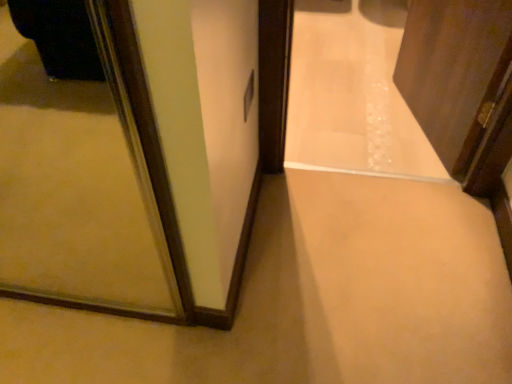
The image size is (512, 384). In order to click on wooden door at upper right in this screenshot , I will do `click(454, 71)`.

What is the approximate width of wooden door at upper right?

wooden door at upper right is 5.74 inches in width.

The height and width of the screenshot is (384, 512). What do you see at coordinates (454, 71) in the screenshot?
I see `wooden door at upper right` at bounding box center [454, 71].

In order to face wooden door at upper right, should I rotate leftwards or rightwards?

Turn right by 23.302 degrees to look at wooden door at upper right.

This screenshot has width=512, height=384. Identify the location of wooden door at upper right. (x=454, y=71).